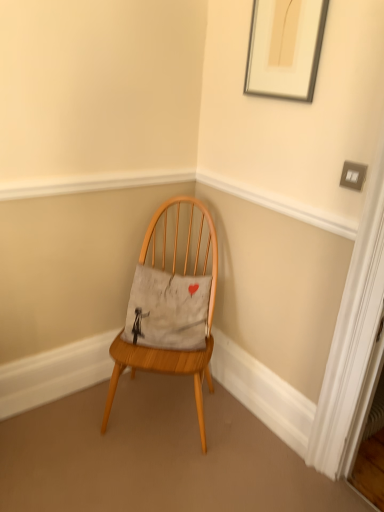
Question: Is silver metallic picture frame at upper right inside or outside of wooden chair at center?

Choices:
 (A) outside
 (B) inside

Answer: (A)

Question: From a real-world perspective, is silver metallic picture frame at upper right physically located above or below wooden chair at center?

Choices:
 (A) above
 (B) below

Answer: (A)

Question: Which of these objects is positioned farthest from the gray cotton pillow at center?

Choices:
 (A) wooden chair at center
 (B) silver metallic picture frame at upper right

Answer: (B)

Question: Based on their relative distances, which object is farther from the silver metallic picture frame at upper right?

Choices:
 (A) gray cotton pillow at center
 (B) wooden chair at center

Answer: (A)